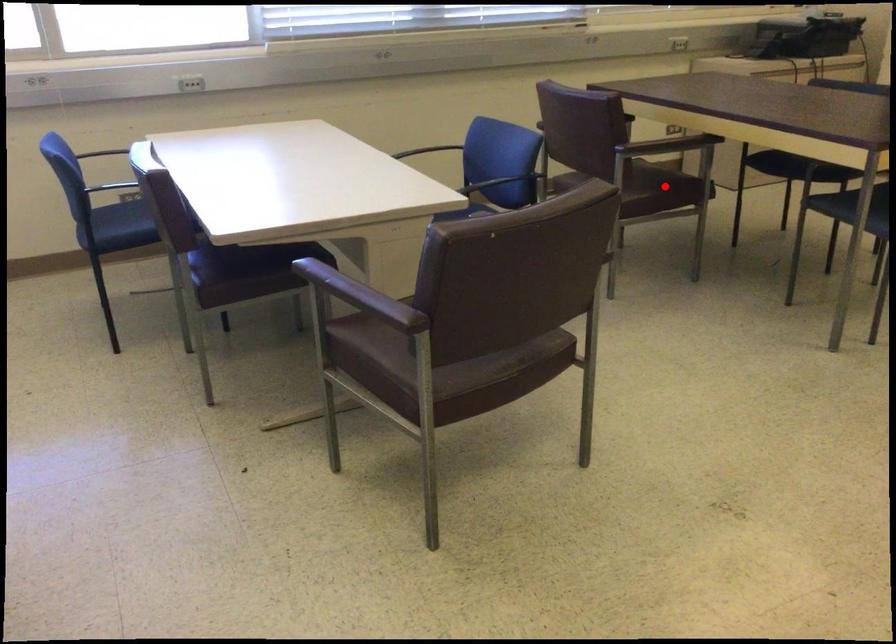
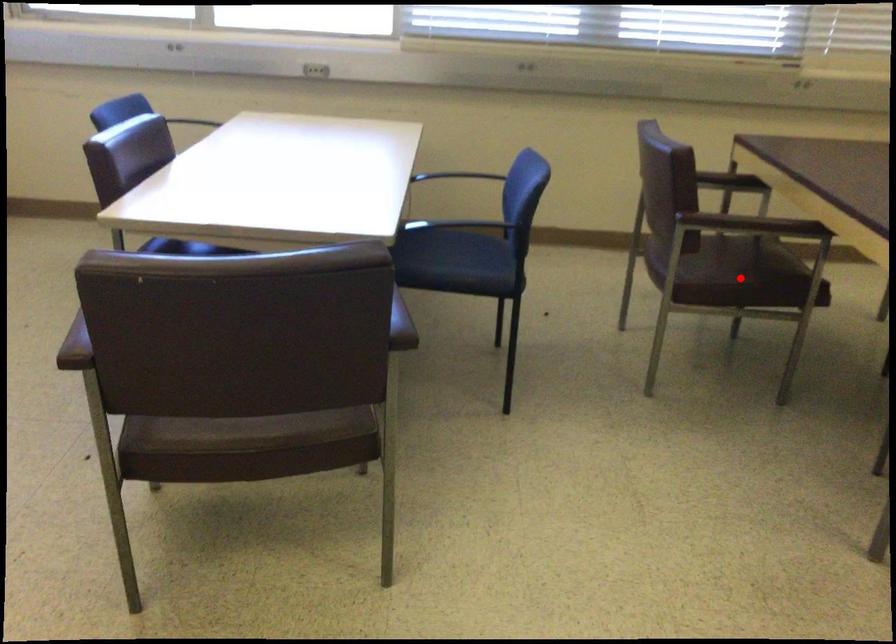
I am providing you with two images of the same scene from different viewpoints. A red point is marked on the first image and another point is marked on the second image. Does the point marked in image1 correspond to the same location as the one in image2?

Yes